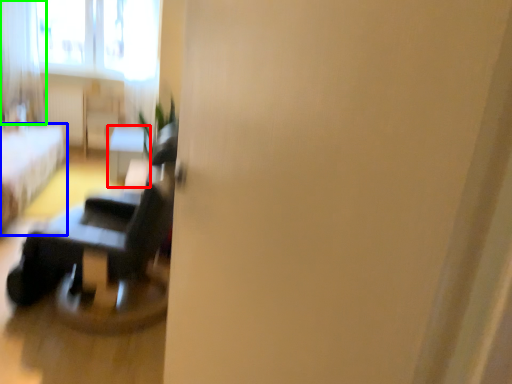
Question: Estimate the real-world distances between objects in this image. Which object is farther from table (highlighted by a red box), furniture (highlighted by a blue box) or curtain (highlighted by a green box)?

Choices:
 (A) furniture
 (B) curtain

Answer: (B)